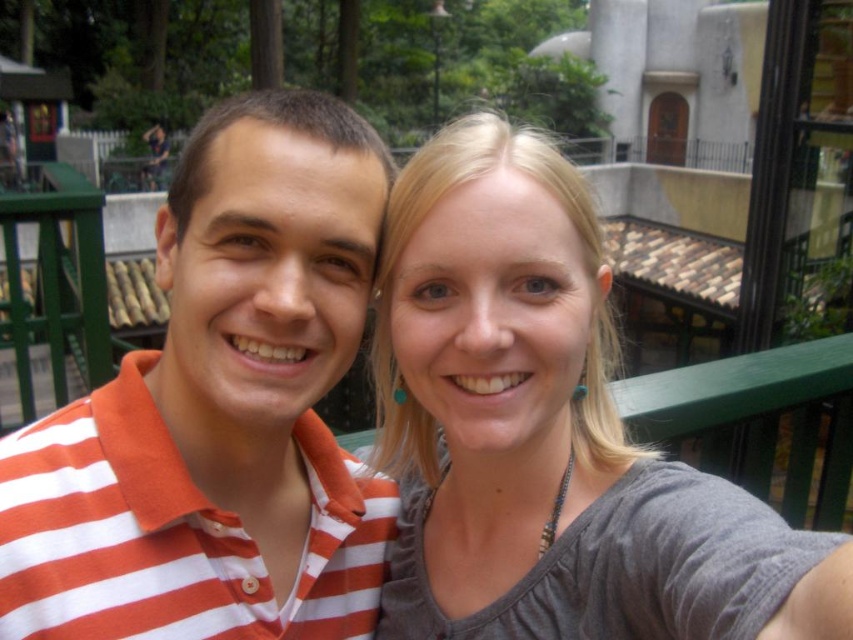
Does orange striped shirt at center have a greater width compared to gray fabric shirt at center?

Yes, orange striped shirt at center is wider than gray fabric shirt at center.

Is orange striped shirt at center below gray fabric shirt at center?

Actually, orange striped shirt at center is above gray fabric shirt at center.

Who is more forward, (x=315, y=321) or (x=434, y=547)?

Point (x=315, y=321)

Locate an element on the screen. Image resolution: width=853 pixels, height=640 pixels. orange striped shirt at center is located at coordinates (219, 410).